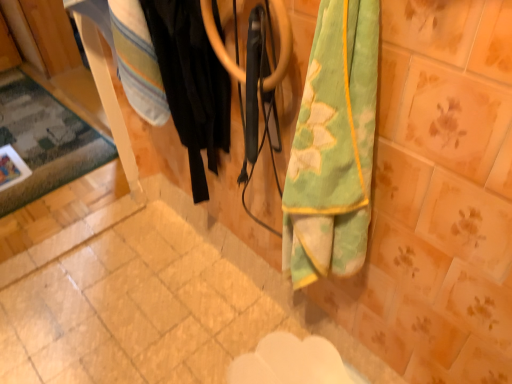
Question: From a real-world perspective, is carpeted rug at left positioned above or below black fabric at center?

Choices:
 (A) above
 (B) below

Answer: (B)

Question: Considering the positions of carpeted rug at left and black fabric at center in the image, is carpeted rug at left wider or thinner than black fabric at center?

Choices:
 (A) thin
 (B) wide

Answer: (B)

Question: In the image, is carpeted rug at left on the left side or the right side of black fabric at center?

Choices:
 (A) left
 (B) right

Answer: (A)

Question: Looking at the image, does black fabric at center seem bigger or smaller compared to carpeted rug at left?

Choices:
 (A) small
 (B) big

Answer: (B)

Question: From a real-world perspective, relative to carpeted rug at left, is black fabric at center vertically above or below?

Choices:
 (A) below
 (B) above

Answer: (B)

Question: Based on their positions, is black fabric at center located to the left or right of carpeted rug at left?

Choices:
 (A) right
 (B) left

Answer: (A)

Question: In the image, is black fabric at center positioned in front of or behind carpeted rug at left?

Choices:
 (A) behind
 (B) front

Answer: (B)